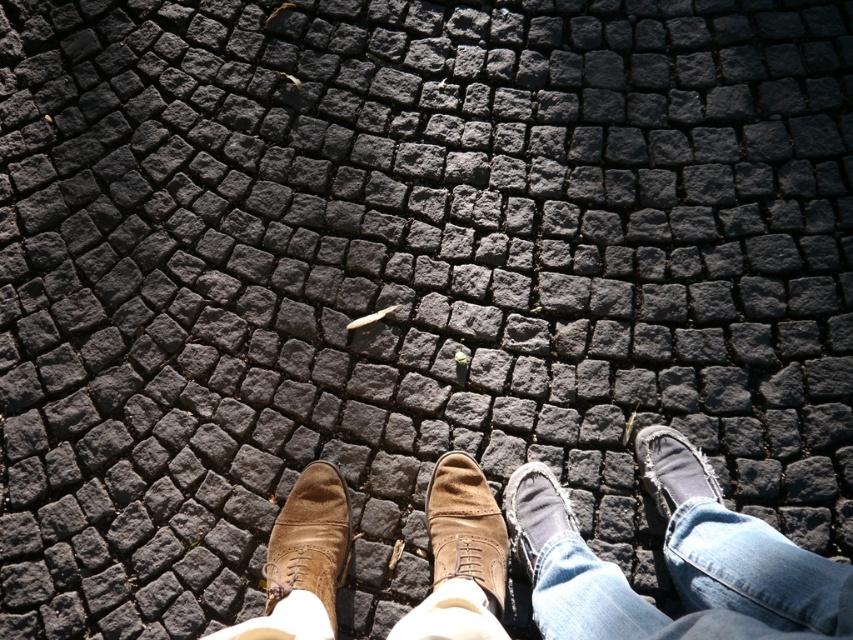
Question: Does brown suede shoe at center appear under worn leather shoe at lower right?

Choices:
 (A) no
 (B) yes

Answer: (B)

Question: Does brown suede shoe at lower left have a smaller size compared to brown suede shoe at center?

Choices:
 (A) yes
 (B) no

Answer: (B)

Question: Estimate the real-world distances between objects in this image. Which object is farther from the brown suede shoe at center?

Choices:
 (A) brown suede shoe at lower left
 (B) brown suede shoes at center

Answer: (A)

Question: Where is brown suede shoe at center located in relation to worn leather shoe at lower right in the image?

Choices:
 (A) above
 (B) below

Answer: (B)

Question: Which object is the closest to the jeans at center?

Choices:
 (A) worn leather shoe at lower right
 (B) leather lace-up shoe at center
 (C) brown suede shoe at lower left

Answer: (A)

Question: Which point is closer to the camera?

Choices:
 (A) (474, 524)
 (B) (537, 598)
 (C) (641, 449)

Answer: (B)